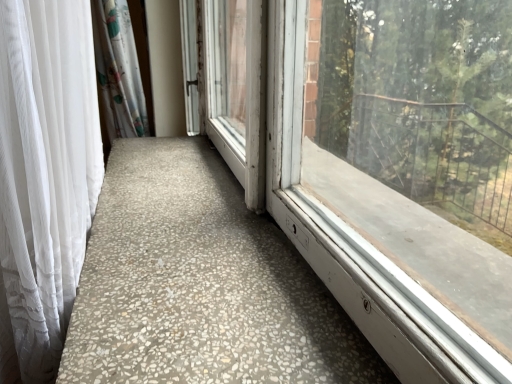
What do you see at coordinates (200, 284) in the screenshot? I see `speckled concrete floor at center` at bounding box center [200, 284].

Locate an element on the screen. The height and width of the screenshot is (384, 512). speckled concrete floor at center is located at coordinates point(200,284).

Find the location of a particular element. The width and height of the screenshot is (512, 384). white sheer curtain at left is located at coordinates (46, 170).

This screenshot has height=384, width=512. Describe the element at coordinates (46, 170) in the screenshot. I see `white sheer curtain at left` at that location.

Locate an element on the screen. speckled concrete floor at center is located at coordinates coord(200,284).

From the picture: Is speckled concrete floor at center to the right of white sheer curtain at left from the viewer's perspective?

Indeed, speckled concrete floor at center is positioned on the right side of white sheer curtain at left.

Between speckled concrete floor at center and white sheer curtain at left, which one is positioned in front?

white sheer curtain at left is in front.

Is point (117, 371) positioned before point (19, 29)?

No, (117, 371) is behind (19, 29).

From the image's perspective, is speckled concrete floor at center located above white sheer curtain at left?

Yes.

From a real-world perspective, is speckled concrete floor at center physically located above or below white sheer curtain at left?

Clearly, from a real-world perspective, speckled concrete floor at center is above white sheer curtain at left.

Considering the relative sizes of speckled concrete floor at center and white sheer curtain at left in the image provided, is speckled concrete floor at center thinner than white sheer curtain at left?

Incorrect, the width of speckled concrete floor at center is not less than that of white sheer curtain at left.

Between speckled concrete floor at center and white sheer curtain at left, which one has less height?

speckled concrete floor at center.

Considering the sizes of speckled concrete floor at center and white sheer curtain at left in the image, is speckled concrete floor at center bigger or smaller than white sheer curtain at left?

Considering their sizes, speckled concrete floor at center takes up less space than white sheer curtain at left.

Could white sheer curtain at left be considered to be inside speckled concrete floor at center?

Actually, white sheer curtain at left is outside speckled concrete floor at center.

Is speckled concrete floor at center not close to white sheer curtain at left?

No, there isn't a large distance between speckled concrete floor at center and white sheer curtain at left.

Is speckled concrete floor at center aimed at white sheer curtain at left?

Yes, speckled concrete floor at center is turned towards white sheer curtain at left.

The image size is (512, 384). Identify the location of concrete that is on the right side of white sheer curtain at left. pyautogui.click(x=200, y=284).

Visually, is white sheer curtain at left positioned to the left or to the right of speckled concrete floor at center?

Based on their positions, white sheer curtain at left is located to the left of speckled concrete floor at center.

Considering the relative positions of white sheer curtain at left and speckled concrete floor at center in the image provided, is white sheer curtain at left behind speckled concrete floor at center?

No, the depth of white sheer curtain at left is less than that of speckled concrete floor at center.

Does point (15, 226) come closer to viewer compared to point (286, 248)?

Yes, it is in front of point (286, 248).

From the image's perspective, is white sheer curtain at left beneath speckled concrete floor at center?

Yes, from the image's perspective, white sheer curtain at left is below speckled concrete floor at center.

Consider the image. From a real-world perspective, is white sheer curtain at left located higher than speckled concrete floor at center?

No, from a real-world perspective, white sheer curtain at left is not over speckled concrete floor at center

In terms of width, does white sheer curtain at left look wider or thinner when compared to speckled concrete floor at center?

white sheer curtain at left is thinner than speckled concrete floor at center.

Does white sheer curtain at left have a greater height compared to speckled concrete floor at center?

Yes, white sheer curtain at left is taller than speckled concrete floor at center.

Between white sheer curtain at left and speckled concrete floor at center, which one has smaller size?

Smaller between the two is speckled concrete floor at center.

Is white sheer curtain at left positioned beyond the bounds of speckled concrete floor at center?

Yes, white sheer curtain at left is outside of speckled concrete floor at center.

Is white sheer curtain at left not near speckled concrete floor at center?

They are positioned close to each other.

Is speckled concrete floor at center at the back of white sheer curtain at left?

Absolutely, white sheer curtain at left is directed away from speckled concrete floor at center.

What's the angular difference between white sheer curtain at left and speckled concrete floor at center's facing directions?

They differ by 1.02 degrees in their facing directions.

Identify the location of concrete located above the white sheer curtain at left (from a real-world perspective). (200, 284).

The height and width of the screenshot is (384, 512). I want to click on concrete lying behind the white sheer curtain at left, so click(x=200, y=284).

The image size is (512, 384). I want to click on curtain below the speckled concrete floor at center (from the image's perspective), so click(x=46, y=170).